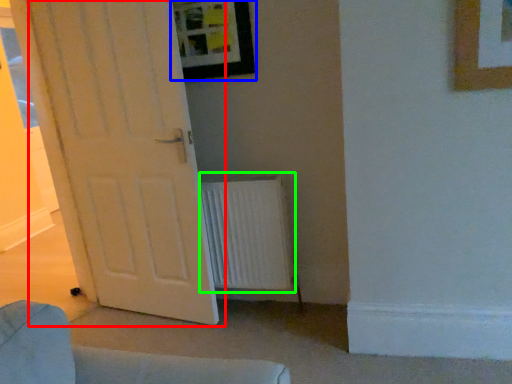
Question: Considering the real-world distances, which object is closest to door (highlighted by a red box)? picture frame (highlighted by a blue box) or radiator (highlighted by a green box).

Choices:
 (A) picture frame
 (B) radiator

Answer: (B)